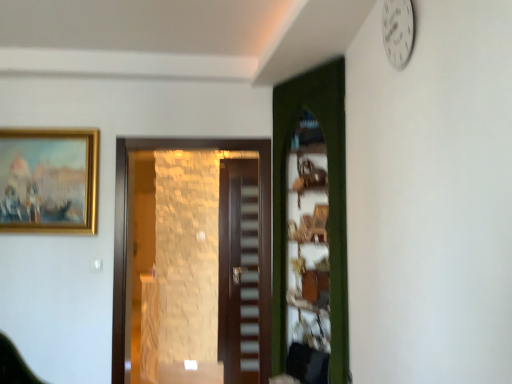
Question: Is brown stone wall at center, the 1th door when ordered from left to right, shorter than gold-framed painting at upper left?

Choices:
 (A) yes
 (B) no

Answer: (B)

Question: Is brown stone wall at center, the second door from the front, smaller than gold-framed painting at upper left?

Choices:
 (A) no
 (B) yes

Answer: (A)

Question: Can you confirm if brown stone wall at center, which is the second door from back to front, is taller than gold-framed painting at upper left?

Choices:
 (A) yes
 (B) no

Answer: (A)

Question: Would you say brown stone wall at center, the 1th door when ordered from left to right, contains gold-framed painting at upper left?

Choices:
 (A) yes
 (B) no

Answer: (B)

Question: From the image's perspective, is brown stone wall at center, the 1th door when ordered from left to right, on gold-framed painting at upper left?

Choices:
 (A) yes
 (B) no

Answer: (B)

Question: From their relative heights in the image, would you say gold-framed painting at upper left is taller or shorter than white plastic clock at upper right?

Choices:
 (A) short
 (B) tall

Answer: (B)

Question: Visually, is gold-framed painting at upper left positioned to the left or to the right of white plastic clock at upper right?

Choices:
 (A) left
 (B) right

Answer: (A)

Question: Relative to white plastic clock at upper right, is gold-framed painting at upper left in front or behind?

Choices:
 (A) front
 (B) behind

Answer: (B)

Question: Do you think gold-framed painting at upper left is within white plastic clock at upper right, or outside of it?

Choices:
 (A) outside
 (B) inside

Answer: (A)

Question: Is brown stone wall at center, the 1th door when ordered from left to right, spatially inside green wooden door at center, which is the 1th door from front to back, or outside of it?

Choices:
 (A) outside
 (B) inside

Answer: (A)

Question: In terms of width, does brown stone wall at center, the second door from the front, look wider or thinner when compared to green wooden door at center, arranged as the 3th door when viewed from the left?

Choices:
 (A) wide
 (B) thin

Answer: (B)

Question: Considering their positions, is brown stone wall at center, the 1th door when ordered from left to right, located in front of or behind green wooden door at center, the third door in the back-to-front sequence?

Choices:
 (A) front
 (B) behind

Answer: (B)

Question: Considering the positions of brown stone wall at center, the second door from the front, and green wooden door at center, the 1th door from the right, in the image, is brown stone wall at center, the second door from the front, taller or shorter than green wooden door at center, the 1th door from the right,?

Choices:
 (A) short
 (B) tall

Answer: (A)

Question: Considering the positions of brown wooden door at center, which is the 3th door in front-to-back order, and dark wood stairwell at center in the image, is brown wooden door at center, which is the 3th door in front-to-back order, taller or shorter than dark wood stairwell at center?

Choices:
 (A) tall
 (B) short

Answer: (B)

Question: In terms of size, does brown wooden door at center, arranged as the 1th door when viewed from the back, appear bigger or smaller than dark wood stairwell at center?

Choices:
 (A) big
 (B) small

Answer: (A)